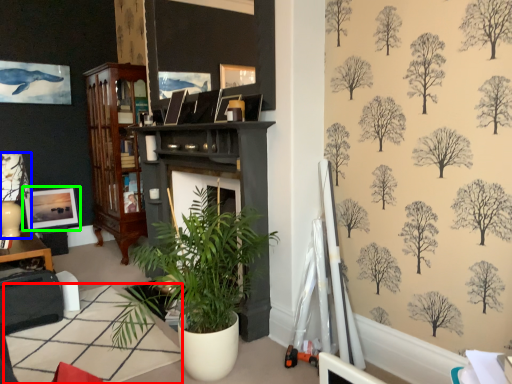
Question: Estimate the real-world distances between objects in this image. Which object is closer to table (highlighted by a red box), lamp (highlighted by a blue box) or picture frame (highlighted by a green box)?

Choices:
 (A) lamp
 (B) picture frame

Answer: (A)